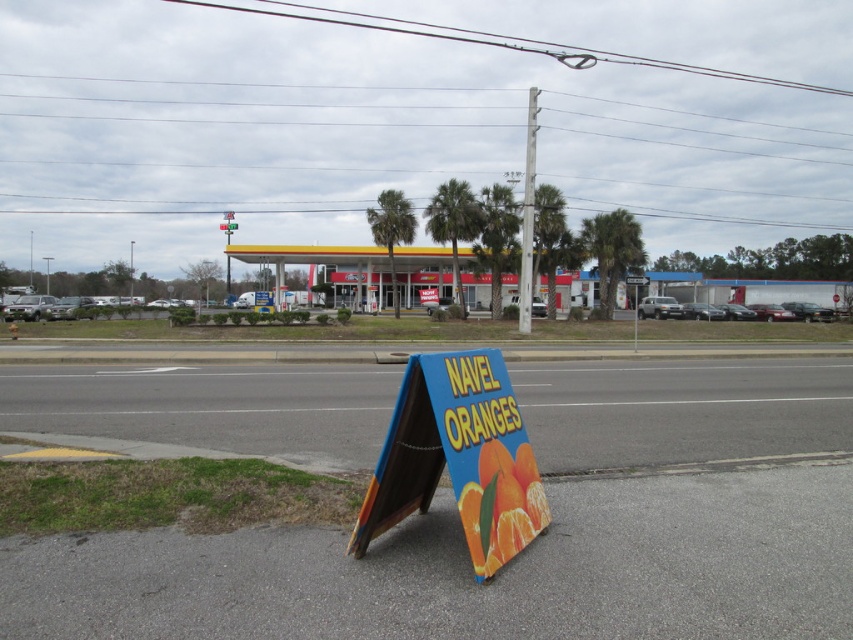
Question: Is white glossy gas station at center in front of metallic silver street sign at center?

Choices:
 (A) no
 (B) yes

Answer: (B)

Question: Which of these objects is positioned closest to the white glossy gas station at center?

Choices:
 (A) wooden pole at center
 (B) metallic silver street sign at center

Answer: (B)

Question: Based on their relative distances, which object is farther from the white glossy gas station at center?

Choices:
 (A) metallic silver street sign at center
 (B) wooden pole at center

Answer: (B)

Question: In this image, where is wooden pole at center located relative to metallic silver street sign at center?

Choices:
 (A) above
 (B) below

Answer: (A)

Question: Among these objects, which one is farthest from the camera?

Choices:
 (A) white glossy gas station at center
 (B) metallic silver street sign at center

Answer: (B)

Question: Is wooden pole at center below metallic silver street sign at center?

Choices:
 (A) yes
 (B) no

Answer: (B)